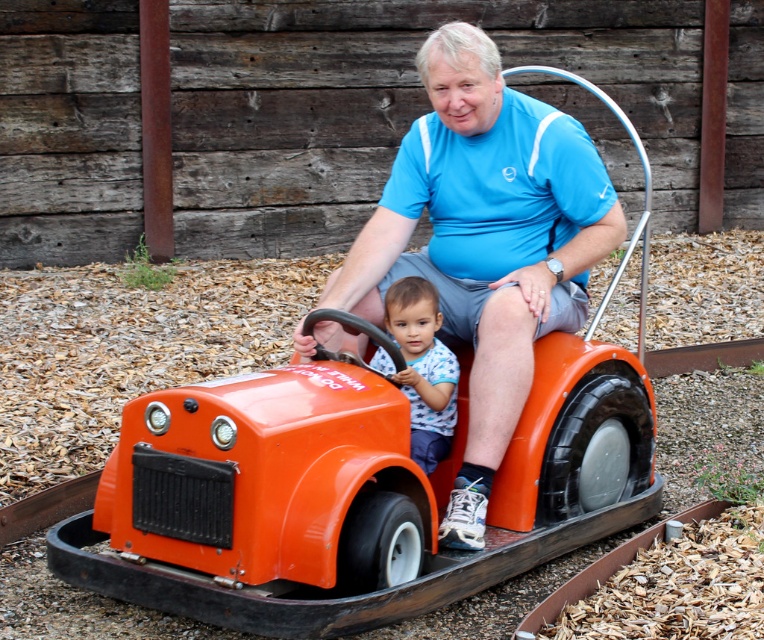
Question: Which of the following is the closest to the observer?

Choices:
 (A) (377, 234)
 (B) (419, 310)

Answer: (B)

Question: Does orange plastic toy car at center appear on the left side of blue dotted shirt at center?

Choices:
 (A) no
 (B) yes

Answer: (B)

Question: Does orange plastic toy car at center come in front of blue dotted shirt at center?

Choices:
 (A) yes
 (B) no

Answer: (A)

Question: Considering the real-world distances, which object is closest to the orange plastic toy car at center?

Choices:
 (A) blue dotted shirt at center
 (B) matte blue shirt at center

Answer: (A)

Question: Which point is farther to the camera?

Choices:
 (A) orange plastic toy car at center
 (B) blue dotted shirt at center

Answer: (B)

Question: Is matte blue shirt at center positioned behind blue dotted shirt at center?

Choices:
 (A) yes
 (B) no

Answer: (B)